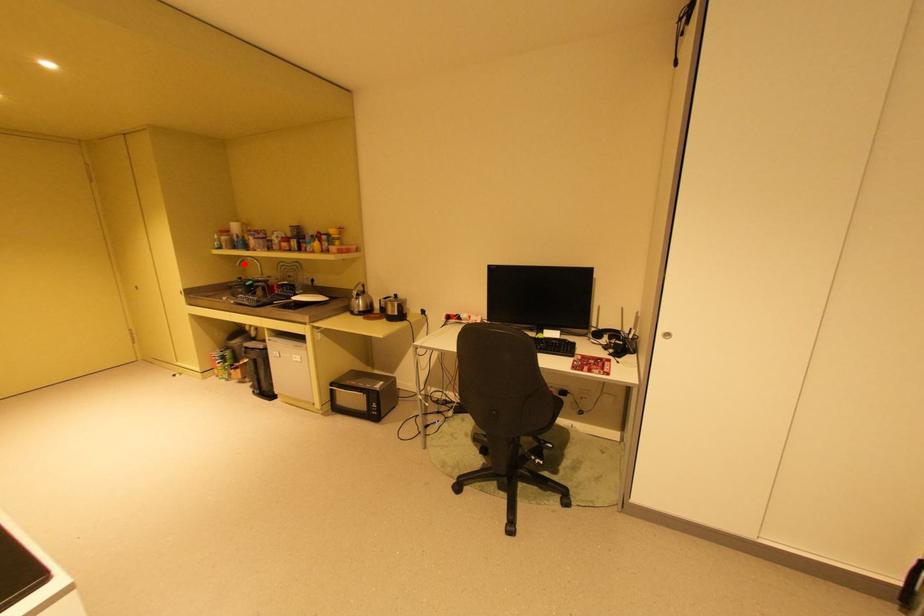
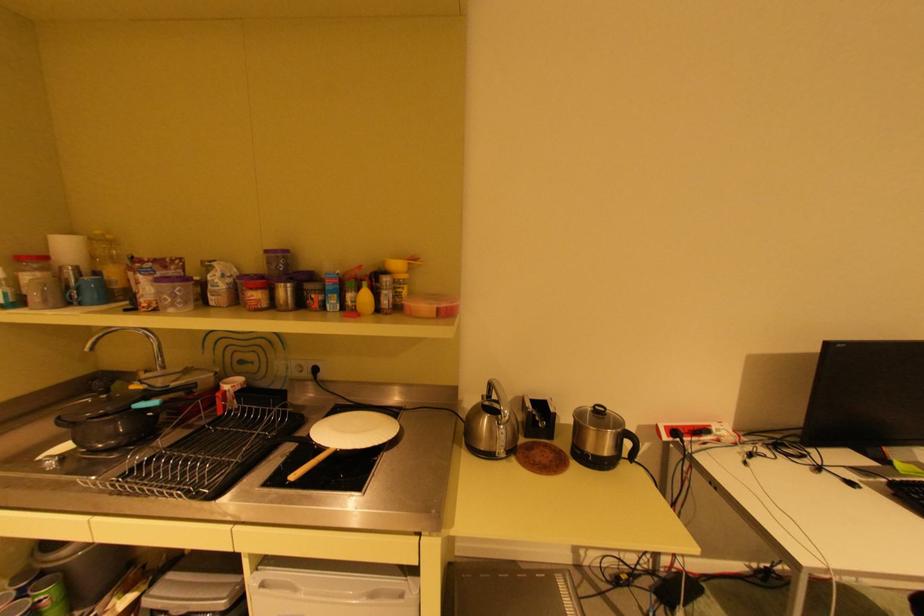
Question: I am providing you with two images of the same scene from different viewpoints. Given a red point in image1, look at the same physical point in image2. Is it:

Choices:
 (A) Closer to the viewpoint
 (B) Farther from the viewpoint

Answer: (B)